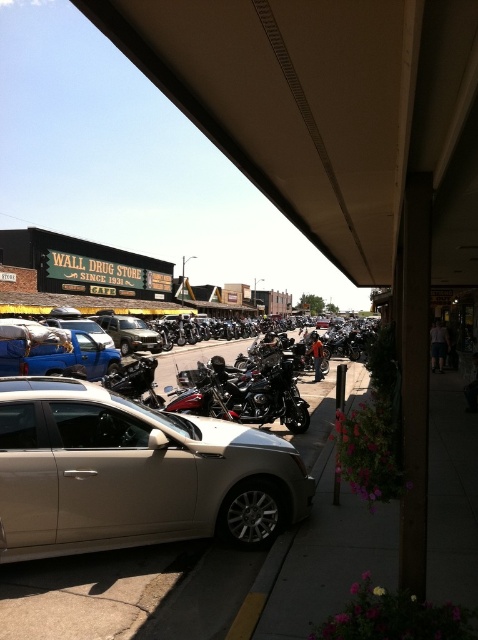
The height and width of the screenshot is (640, 478). What do you see at coordinates (133, 474) in the screenshot?
I see `satin silver sedan at center` at bounding box center [133, 474].

Can you confirm if satin silver sedan at center is shorter than blue matte truck at left?

No.

Which is in front, point (139, 424) or point (22, 362)?

Point (139, 424) is in front.

Where is `satin silver sedan at center`? The height and width of the screenshot is (640, 478). satin silver sedan at center is located at coordinates (133, 474).

The width and height of the screenshot is (478, 640). Identify the location of shiny chrome motorcycle at center. (245, 396).

Is shiny chrome motorcycle at center to the right of matte blue truck at center-left from the viewer's perspective?

Correct, you'll find shiny chrome motorcycle at center to the right of matte blue truck at center-left.

Where is `shiny chrome motorcycle at center`? The image size is (478, 640). shiny chrome motorcycle at center is located at coordinates (245, 396).

This screenshot has height=640, width=478. Find the location of `shiny chrome motorcycle at center`. shiny chrome motorcycle at center is located at coordinates (245, 396).

Between point (272, 368) and point (117, 349), which one is positioned in front?

Point (272, 368) is in front.

Is shiny chrome motorcycle at center thinner than blue matte truck at left?

No.

Where is `shiny chrome motorcycle at center`? shiny chrome motorcycle at center is located at coordinates [x=245, y=396].

In order to click on shiny chrome motorcycle at center in this screenshot , I will do `click(245, 396)`.